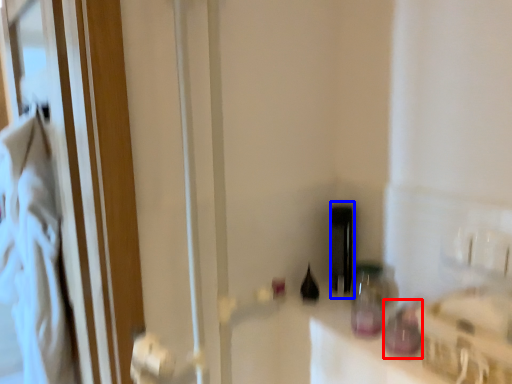
Question: Which of the following is the closest to the observer, bottle (highlighted by a red box) or bottle (highlighted by a blue box)?

Choices:
 (A) bottle
 (B) bottle

Answer: (A)